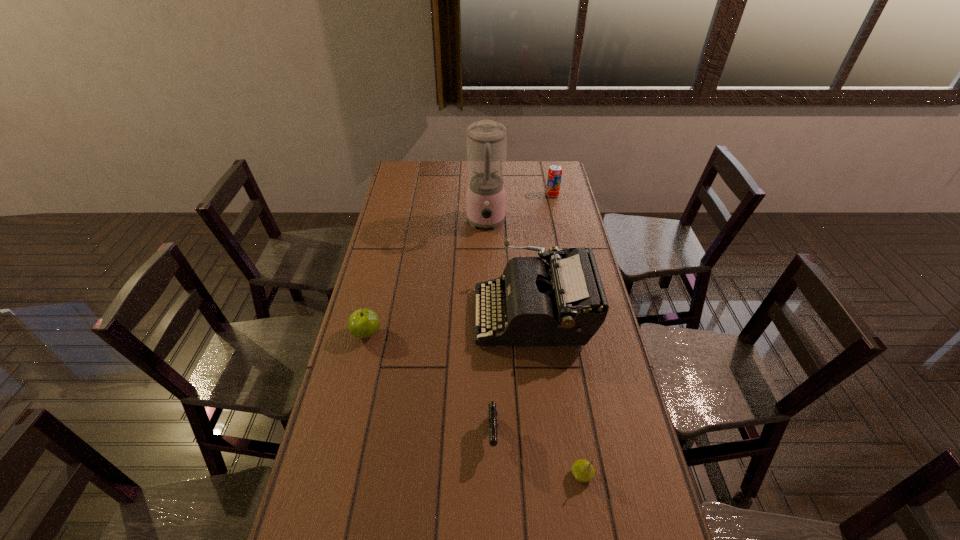
In order to click on blank region between the second farthest object and the nearest object in this screenshot , I will do `click(534, 349)`.

This screenshot has height=540, width=960. I want to click on object that is the third nearest to the soda can, so click(x=363, y=323).

At what (x,y) coordinates should I click in order to perform the action: click on object that ranks as the closest to the apple. Please return your answer as a coordinate pair (x, y). The height and width of the screenshot is (540, 960). Looking at the image, I should click on (564, 303).

Locate an element on the screen. The height and width of the screenshot is (540, 960). vacant space that satisfies the following two spatial constraints: 1. on the base of the food processor near the control knob; 2. on the right side of the nearest object is located at coordinates (490, 475).

Find the location of `vacant region that satisfies the following two spatial constraints: 1. at the barrel of the nearest object; 2. on the right side of the fifth farthest object`. vacant region that satisfies the following two spatial constraints: 1. at the barrel of the nearest object; 2. on the right side of the fifth farthest object is located at coordinates (493, 475).

Where is `vacant space that satisfies the following two spatial constraints: 1. on the base of the nearest object near the control knob; 2. on the right side of the tallest object`? The width and height of the screenshot is (960, 540). vacant space that satisfies the following two spatial constraints: 1. on the base of the nearest object near the control knob; 2. on the right side of the tallest object is located at coordinates (490, 475).

Where is `blank area in the image that satisfies the following two spatial constraints: 1. on the back side of the pear; 2. on the front-facing side of the typewriter`? The image size is (960, 540). blank area in the image that satisfies the following two spatial constraints: 1. on the back side of the pear; 2. on the front-facing side of the typewriter is located at coordinates [x=555, y=315].

The height and width of the screenshot is (540, 960). Find the location of `free region that satisfies the following two spatial constraints: 1. on the front-facing side of the second tallest object; 2. on the back side of the nearest object`. free region that satisfies the following two spatial constraints: 1. on the front-facing side of the second tallest object; 2. on the back side of the nearest object is located at coordinates (552, 475).

The height and width of the screenshot is (540, 960). Identify the location of vacant region that satisfies the following two spatial constraints: 1. on the front-facing side of the typewriter; 2. on the right side of the nearest object. (552, 475).

Locate an element on the screen. This screenshot has height=540, width=960. vacant region that satisfies the following two spatial constraints: 1. on the base of the nearest object near the control knob; 2. on the right side of the food processor is located at coordinates (490, 475).